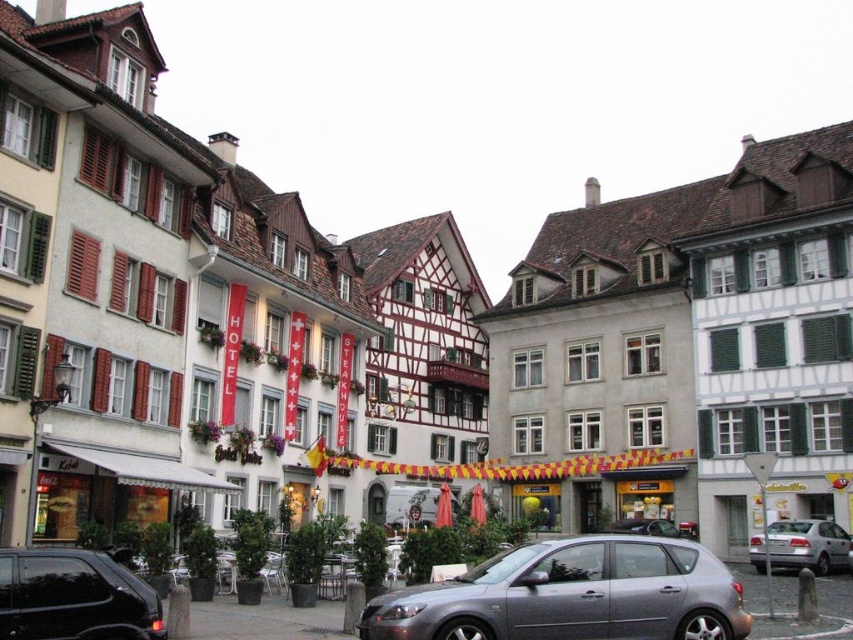
Question: Which of the following is the farthest from the observer?

Choices:
 (A) shiny black car at lower left
 (B) silver metallic sedan at lower right
 (C) metallic gray hatchback at center

Answer: (B)

Question: Does shiny black car at lower left appear under silver metallic sedan at lower right?

Choices:
 (A) yes
 (B) no

Answer: (B)

Question: Is metallic gray hatchback at center positioned behind shiny black car at lower left?

Choices:
 (A) yes
 (B) no

Answer: (A)

Question: Which point is closer to the camera taking this photo?

Choices:
 (A) (770, 541)
 (B) (9, 611)

Answer: (B)

Question: Is shiny black car at lower left below silver metallic sedan at lower right?

Choices:
 (A) no
 (B) yes

Answer: (A)

Question: Among these points, which one is nearest to the camera?

Choices:
 (A) (67, 625)
 (B) (782, 564)

Answer: (A)